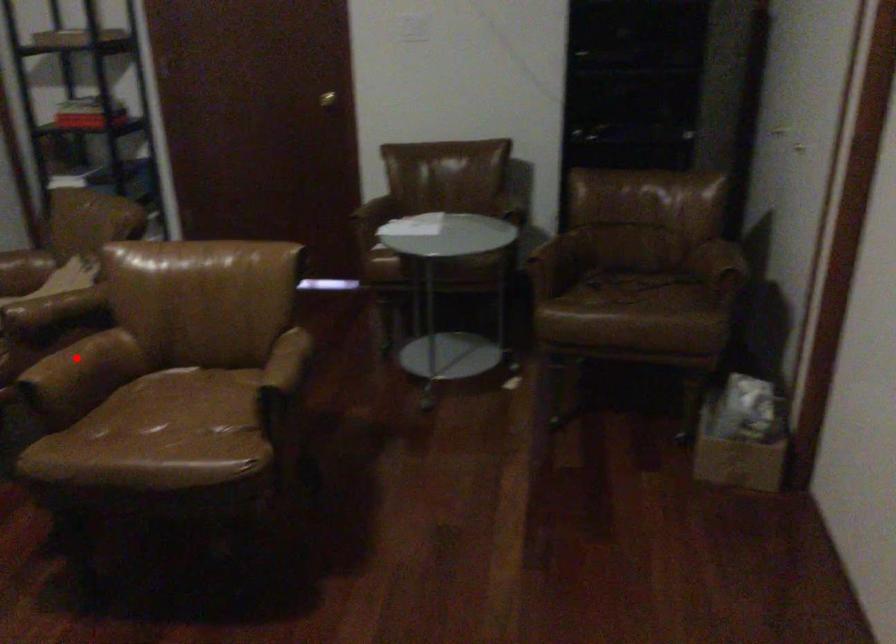
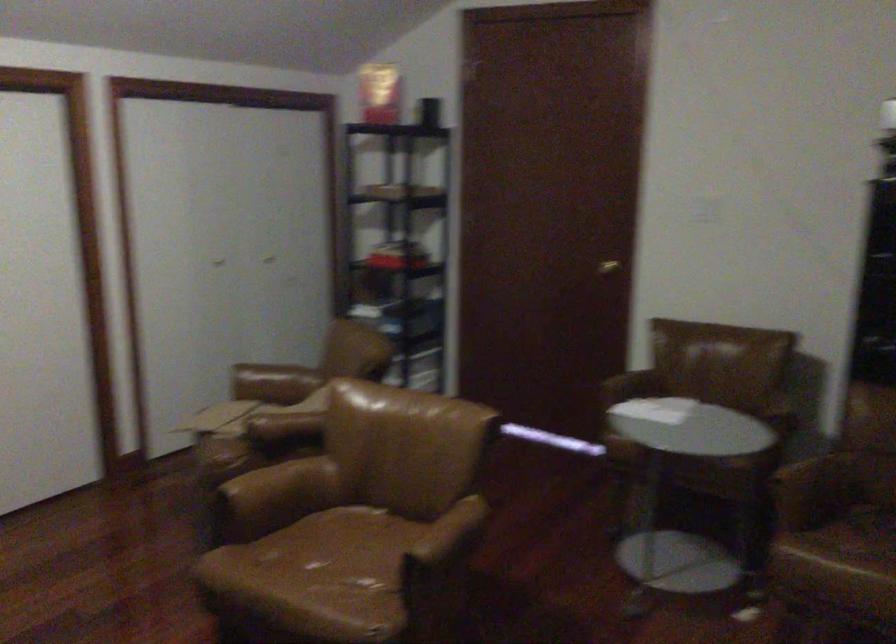
The point at the highlighted location is marked in the first image. Where is the corresponding point in the second image?

(280, 484)